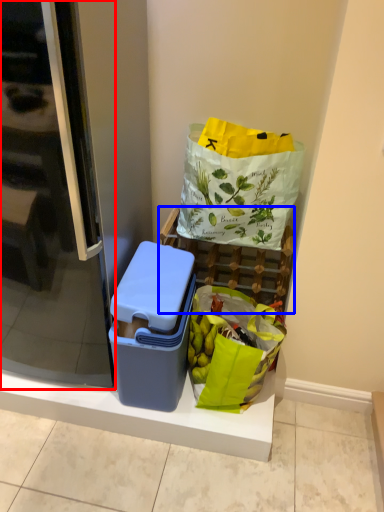
Question: Which point is further to the camera, screen door (highlighted by a red box) or shelf (highlighted by a blue box)?

Choices:
 (A) screen door
 (B) shelf

Answer: (B)